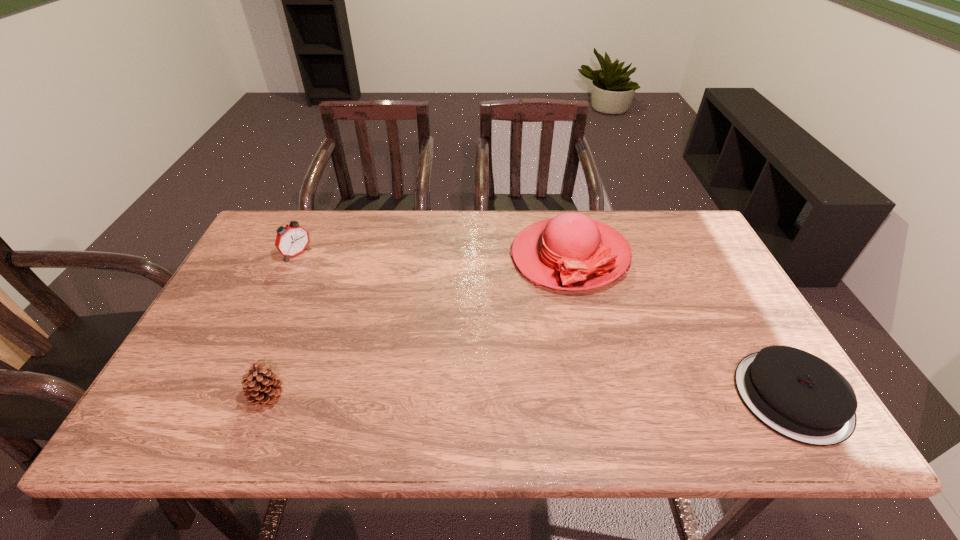
The image size is (960, 540). Find the location of `vacant space that satisfies the following two spatial constraints: 1. on the front side of the tallest object; 2. on the right side of the pancake`. vacant space that satisfies the following two spatial constraints: 1. on the front side of the tallest object; 2. on the right side of the pancake is located at coordinates (601, 397).

You are a GUI agent. You are given a task and a screenshot of the screen. Output one action in this format:
    pyautogui.click(x=<x>, y=<y>)
    Task: Click on the vacant area in the image that satisfies the following two spatial constraints: 1. on the front side of the leftmost object; 2. on the right side of the shortest object
    
    Given the screenshot: What is the action you would take?
    pyautogui.click(x=231, y=397)

At what (x,y) coordinates should I click in order to perform the action: click on vacant region that satisfies the following two spatial constraints: 1. on the front side of the pinecone; 2. on the right side of the leftmost object. Please return your answer as a coordinate pair (x, y). Looking at the image, I should click on (230, 397).

Where is `free region that satisfies the following two spatial constraints: 1. on the front side of the leftmost object; 2. on the right side of the pancake`? free region that satisfies the following two spatial constraints: 1. on the front side of the leftmost object; 2. on the right side of the pancake is located at coordinates (231, 397).